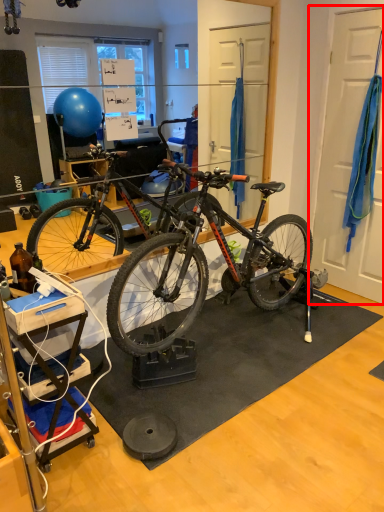
Question: From the image's perspective, where is door (annotated by the red box) located relative to doormat?

Choices:
 (A) above
 (B) below

Answer: (A)